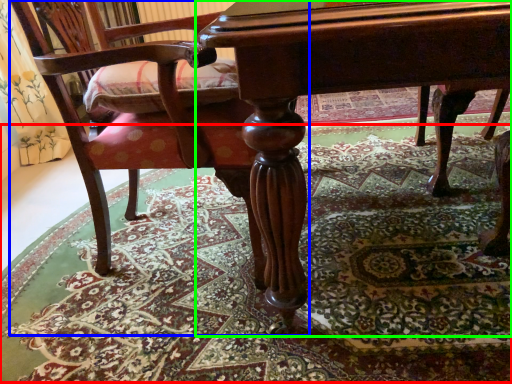
Question: Based on their relative distances, which object is farther from mat (highlighted by a red box)? Choose from chair (highlighted by a blue box) and table (highlighted by a green box).

Choices:
 (A) chair
 (B) table

Answer: (B)